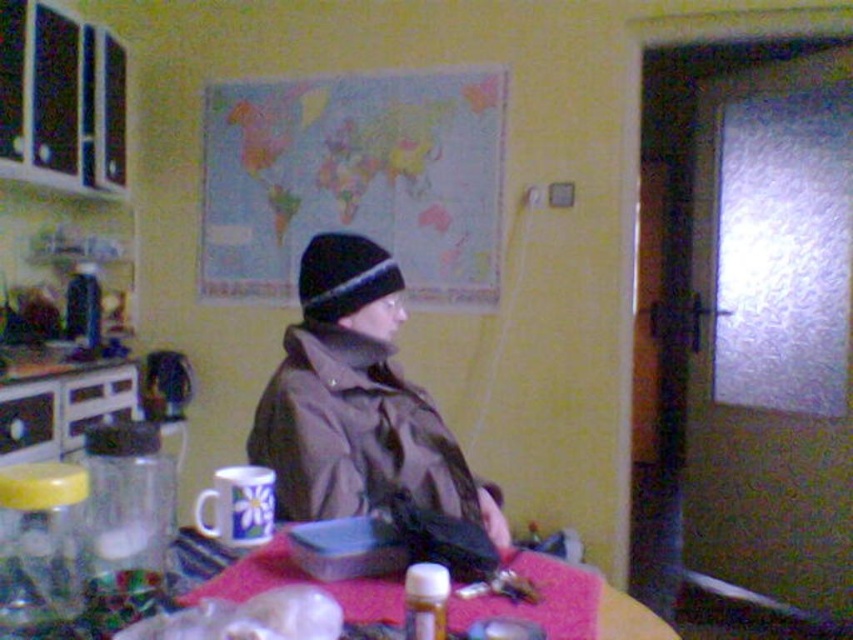
You are trying to decide which item to pack first for your trip. You see the brown matte jacket at center and the black knit hat at center. Which item takes up more space?

The brown matte jacket at center is bigger than the black knit hat at center, so it takes up more space.

You are helping someone choose an outfit and notice they have a brown matte jacket at center and a black knit hat at center. Which item should they wear first to ensure proper layering?

The brown matte jacket at center is taller than the black knit hat at center, so they should put on the brown matte jacket at center first to ensure the hat sits properly on top.